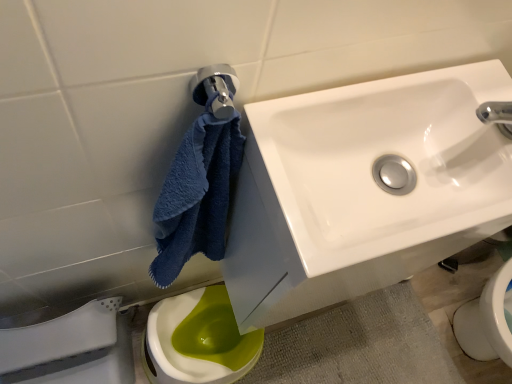
Question: Is white glossy sink at upper right inside green glossy toilet at lower left?

Choices:
 (A) no
 (B) yes

Answer: (A)

Question: Is green glossy toilet at lower left oriented towards white glossy sink at upper right?

Choices:
 (A) no
 (B) yes

Answer: (A)

Question: Does green glossy toilet at lower left have a greater width compared to white glossy sink at upper right?

Choices:
 (A) no
 (B) yes

Answer: (B)

Question: From the image's perspective, is green glossy toilet at lower left located above white glossy sink at upper right?

Choices:
 (A) yes
 (B) no

Answer: (B)

Question: Is green glossy toilet at lower left thinner than white glossy sink at upper right?

Choices:
 (A) yes
 (B) no

Answer: (B)

Question: From a real-world perspective, relative to green glossy toilet at lower left, is white glossy sink at upper right vertically above or below?

Choices:
 (A) above
 (B) below

Answer: (A)

Question: From the image's perspective, is white glossy sink at upper right above or below green glossy toilet at lower left?

Choices:
 (A) below
 (B) above

Answer: (B)

Question: Do you think white glossy sink at upper right is within green glossy toilet at lower left, or outside of it?

Choices:
 (A) inside
 (B) outside

Answer: (B)

Question: In terms of size, does white glossy sink at upper right appear bigger or smaller than green glossy toilet at lower left?

Choices:
 (A) small
 (B) big

Answer: (A)

Question: Is white glossy porcelain at lower left spatially inside green glossy toilet at lower left, or outside of it?

Choices:
 (A) outside
 (B) inside

Answer: (A)

Question: Is white glossy porcelain at lower left to the left or to the right of green glossy toilet at lower left in the image?

Choices:
 (A) right
 (B) left

Answer: (B)

Question: Is white glossy porcelain at lower left bigger or smaller than green glossy toilet at lower left?

Choices:
 (A) big
 (B) small

Answer: (A)

Question: Is white glossy porcelain at lower left in front of or behind green glossy toilet at lower left in the image?

Choices:
 (A) behind
 (B) front

Answer: (B)

Question: Considering the relative positions of green glossy toilet at lower left and white glossy sink at upper right in the image provided, is green glossy toilet at lower left to the left or to the right of white glossy sink at upper right?

Choices:
 (A) left
 (B) right

Answer: (A)

Question: Considering the positions of green glossy toilet at lower left and white glossy sink at upper right in the image, is green glossy toilet at lower left wider or thinner than white glossy sink at upper right?

Choices:
 (A) thin
 (B) wide

Answer: (B)